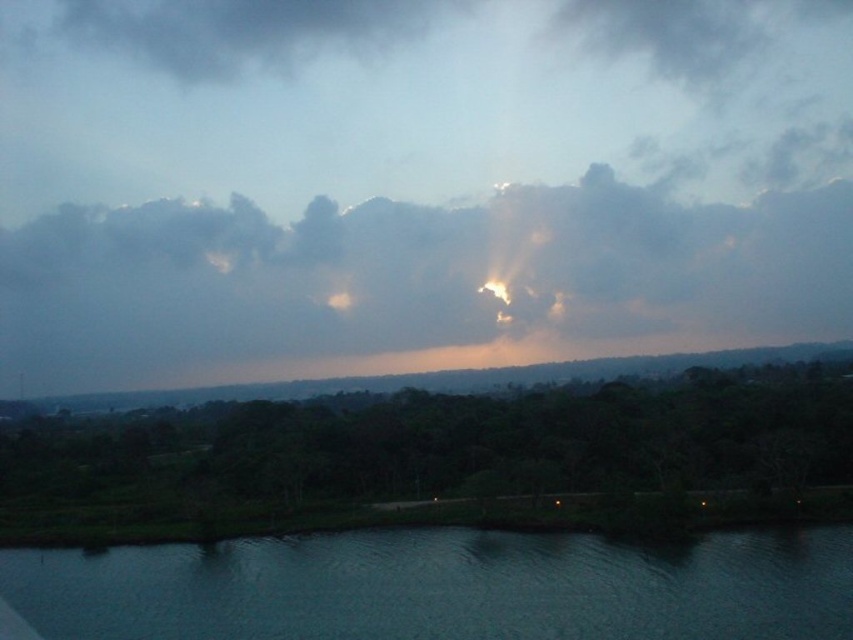
Question: Which object is farther from the camera taking this photo?

Choices:
 (A) dark blue water at lower center
 (B) smokey gray cloud at upper center

Answer: (B)

Question: Can you confirm if smokey gray cloud at upper center is positioned to the right of dark blue water at lower center?

Choices:
 (A) no
 (B) yes

Answer: (B)

Question: Can you confirm if smokey gray cloud at upper center is positioned below dark blue water at lower center?

Choices:
 (A) yes
 (B) no

Answer: (B)

Question: Is smokey gray cloud at upper center closer to the viewer compared to dark blue water at lower center?

Choices:
 (A) no
 (B) yes

Answer: (A)